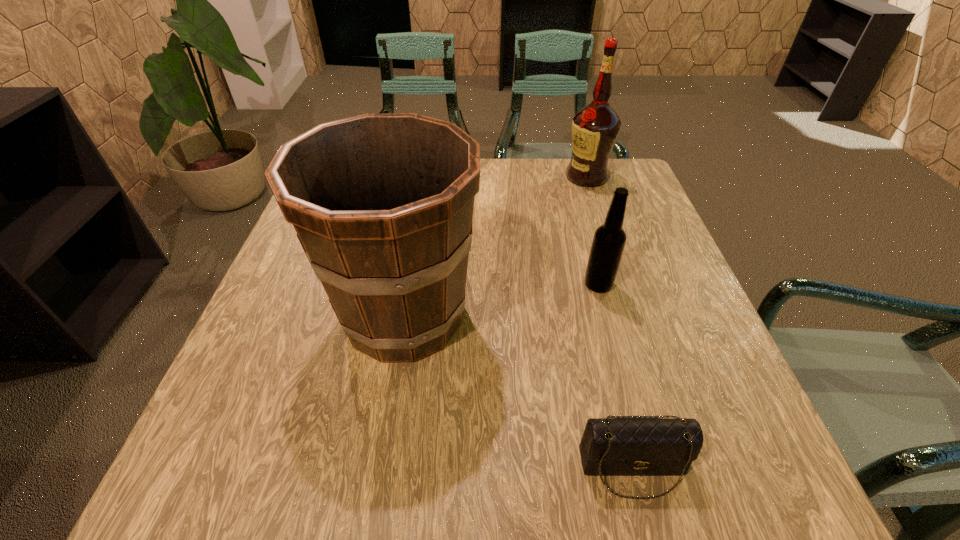
Find the location of `empty space between the bucket and the farthest object`. empty space between the bucket and the farthest object is located at coordinates (495, 246).

What are the coordinates of `unoccupied area between the clutch bag and the beer bottle` in the screenshot? It's located at [x=615, y=376].

This screenshot has width=960, height=540. I want to click on empty space between the second shortest object and the farthest object, so click(592, 231).

Select which object is the second closest to the leftmost object. Please provide its 2D coordinates. Your answer should be formatted as a tuple, i.e. [(x, y)], where the tuple contains the x and y coordinates of a point satisfying the conditions above.

[(609, 240)]

You are a GUI agent. You are given a task and a screenshot of the screen. Output one action in this format:
    pyautogui.click(x=<x>, y=<y>)
    Task: Click on the object that is the second closest to the nearest object
    The width and height of the screenshot is (960, 540).
    Given the screenshot: What is the action you would take?
    pyautogui.click(x=609, y=240)

Where is `vacant space that satisfies the following two spatial constraints: 1. on the label of the farthest object; 2. on the front flap of the clutch bag`? The width and height of the screenshot is (960, 540). vacant space that satisfies the following two spatial constraints: 1. on the label of the farthest object; 2. on the front flap of the clutch bag is located at coordinates (682, 468).

Locate an element on the screen. vacant area that satisfies the following two spatial constraints: 1. on the back side of the leftmost object; 2. on the left side of the second shortest object is located at coordinates (409, 284).